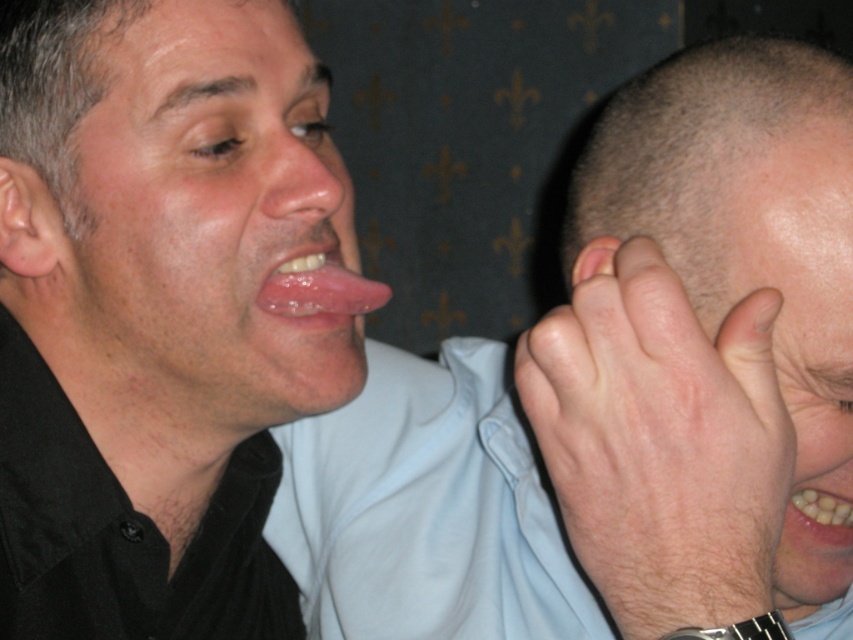
Is point (306, 193) closer to camera compared to point (592, 273)?

That is False.

I want to click on smooth skin nose at center, so click(300, 173).

Where is `smooth skin nose at center`? This screenshot has width=853, height=640. smooth skin nose at center is located at coordinates (300, 173).

Between matte skin hand at center and light brown hair at right, which one has more height?

Standing taller between the two is matte skin hand at center.

Is matte skin hand at center wider than light brown hair at right?

Yes, matte skin hand at center is wider than light brown hair at right.

Between point (657, 236) and point (807, 429), which one is positioned in front?

Point (807, 429) is in front.

The height and width of the screenshot is (640, 853). What are the coordinates of `matte skin hand at center` in the screenshot? It's located at (622, 397).

Is point (306, 308) closer to camera compared to point (596, 252)?

That is False.

What do you see at coordinates (318, 292) in the screenshot? I see `glossy pink tongue at center` at bounding box center [318, 292].

I want to click on glossy pink tongue at center, so click(x=318, y=292).